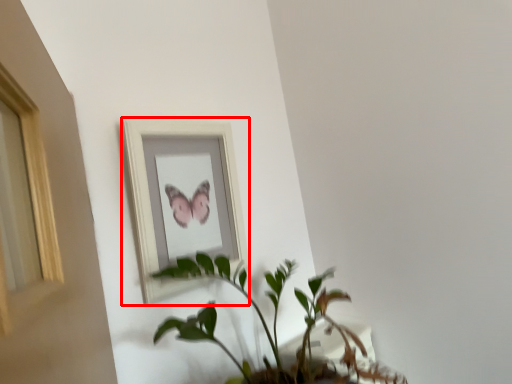
Question: From the image's perspective, what is the correct spatial relationship of picture frame (annotated by the red box) in relation to houseplant?

Choices:
 (A) below
 (B) above

Answer: (B)